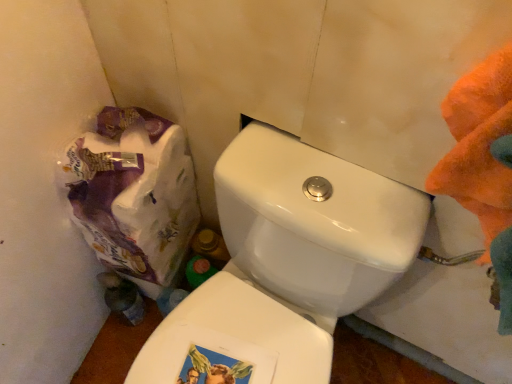
Question: Considering the relative sizes of white glossy toilet at center and white paper bag at lower left in the image provided, is white glossy toilet at center bigger than white paper bag at lower left?

Choices:
 (A) yes
 (B) no

Answer: (A)

Question: Considering the relative sizes of white glossy toilet at center and white paper bag at lower left in the image provided, is white glossy toilet at center smaller than white paper bag at lower left?

Choices:
 (A) no
 (B) yes

Answer: (A)

Question: From the image's perspective, would you say white glossy toilet at center is shown under white paper bag at lower left?

Choices:
 (A) yes
 (B) no

Answer: (A)

Question: Is white glossy toilet at center far away from white paper bag at lower left?

Choices:
 (A) no
 (B) yes

Answer: (A)

Question: From a real-world perspective, is white glossy toilet at center physically below white paper bag at lower left?

Choices:
 (A) yes
 (B) no

Answer: (A)

Question: Is white paper bag at lower left completely or partially inside white glossy toilet at center?

Choices:
 (A) yes
 (B) no

Answer: (B)

Question: Is white glossy toilet at center located within white paper bag at lower left?

Choices:
 (A) yes
 (B) no

Answer: (B)

Question: Is white paper bag at lower left turned away from white glossy toilet at center?

Choices:
 (A) yes
 (B) no

Answer: (B)

Question: Would you consider white paper bag at lower left to be distant from white glossy toilet at center?

Choices:
 (A) yes
 (B) no

Answer: (B)

Question: From the image's perspective, is white paper bag at lower left under white glossy toilet at center?

Choices:
 (A) no
 (B) yes

Answer: (A)

Question: Can you confirm if white paper bag at lower left is wider than white glossy toilet at center?

Choices:
 (A) no
 (B) yes

Answer: (A)

Question: Is white paper bag at lower left to the right of white glossy toilet at center from the viewer's perspective?

Choices:
 (A) no
 (B) yes

Answer: (A)

Question: Is point (346, 211) positioned closer to the camera than point (188, 226)?

Choices:
 (A) farther
 (B) closer

Answer: (B)